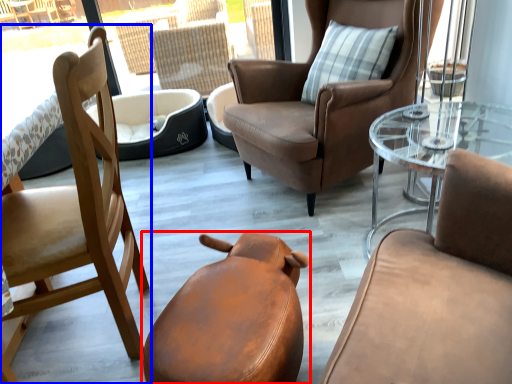
Question: Which of the following is the farthest to the observer, chair (highlighted by a red box) or chair (highlighted by a blue box)?

Choices:
 (A) chair
 (B) chair

Answer: (B)